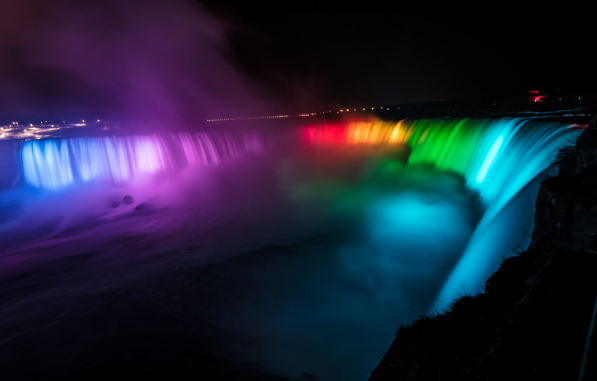
The image size is (597, 381). Find the location of `purple lights`. purple lights is located at coordinates (223, 147).